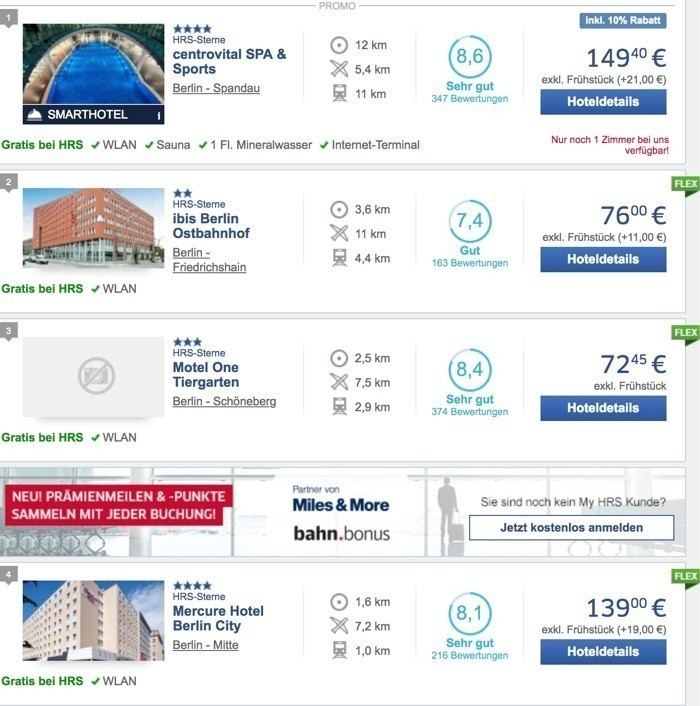
Identify the location of divider bar. point(274,315), point(292,460), point(276,164).